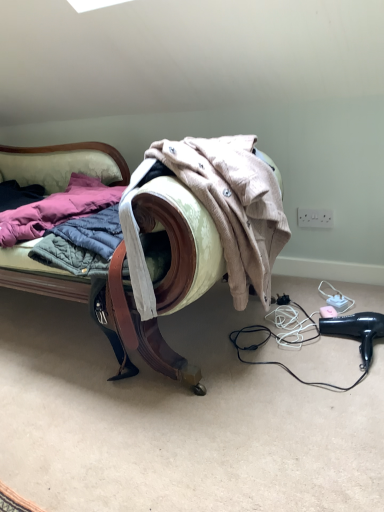
You are a GUI agent. You are given a task and a screenshot of the screen. Output one action in this format:
    pyautogui.click(x=<x>, y=<y>)
    Task: Click on the free space behind black plastic hair dryer at lower right
    
    Given the screenshot: What is the action you would take?
    pyautogui.click(x=331, y=314)